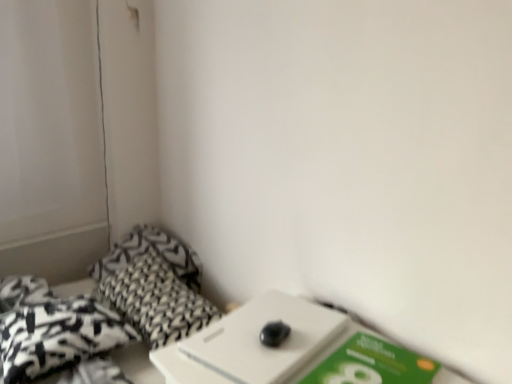
Image resolution: width=512 pixels, height=384 pixels. What do you see at coordinates (108, 309) in the screenshot?
I see `black printed fabric at lower left` at bounding box center [108, 309].

The image size is (512, 384). Describe the element at coordinates (293, 350) in the screenshot. I see `white plastic table at lower left` at that location.

This screenshot has width=512, height=384. Identify the location of black textured pillow at lower left, which is the first pillow in back-to-front order. (147, 250).

This screenshot has width=512, height=384. Describe the element at coordinates (147, 250) in the screenshot. I see `black textured pillow at lower left, which appears as the 2th pillow when viewed from the front` at that location.

Image resolution: width=512 pixels, height=384 pixels. What do you see at coordinates (58, 335) in the screenshot?
I see `black and white patterned throw pillow at lower left` at bounding box center [58, 335].

Where is `black and white patterned throw pillow at lower left`? This screenshot has width=512, height=384. black and white patterned throw pillow at lower left is located at coordinates (58, 335).

What are the coordinates of `green matte paperback book at lower right` in the screenshot? It's located at (372, 364).

Identify the location of black printed fabric at lower left. (108, 309).

Could you tell me if black printed fabric at lower left is facing green matte paperback book at lower right?

Yes, black printed fabric at lower left is aimed at green matte paperback book at lower right.

Does black printed fabric at lower left have a smaller size compared to green matte paperback book at lower right?

Incorrect, black printed fabric at lower left is not smaller in size than green matte paperback book at lower right.

From a real-world perspective, is black printed fabric at lower left beneath green matte paperback book at lower right?

Yes.

Between black printed fabric at lower left and green matte paperback book at lower right, which one has smaller width?

Thinner between the two is green matte paperback book at lower right.

Locate an element on the screen. the 1st pillow positioned below the green matte paperback book at lower right (from a real-world perspective) is located at coordinates (147, 250).

Do you think black textured pillow at lower left, which appears as the 2th pillow when viewed from the front, is within green matte paperback book at lower right, or outside of it?

black textured pillow at lower left, which appears as the 2th pillow when viewed from the front, is outside green matte paperback book at lower right.

Looking at this image, from a real-world perspective, is black textured pillow at lower left, which appears as the 2th pillow when viewed from the front, positioned above or below green matte paperback book at lower right?

From a real-world perspective, black textured pillow at lower left, which appears as the 2th pillow when viewed from the front, is physically below green matte paperback book at lower right.

Is black textured pillow at lower left, the 1th pillow from the front, in front of or behind black printed fabric at lower left in the image?

black textured pillow at lower left, the 1th pillow from the front, is behind black printed fabric at lower left.

Is black textured pillow at lower left, the 2th pillow in the back-to-front sequence, facing towards black printed fabric at lower left?

No, black textured pillow at lower left, the 2th pillow in the back-to-front sequence, is not turned towards black printed fabric at lower left.

Considering the sizes of objects black textured pillow at lower left, the 2th pillow in the back-to-front sequence, and black printed fabric at lower left in the image provided, who is shorter, black textured pillow at lower left, the 2th pillow in the back-to-front sequence, or black printed fabric at lower left?

black textured pillow at lower left, the 2th pillow in the back-to-front sequence, is shorter.

Could you tell me if white plastic table at lower left is facing black textured pillow at lower left, the 2th pillow in the back-to-front sequence?

No, white plastic table at lower left is not facing towards black textured pillow at lower left, the 2th pillow in the back-to-front sequence.

Considering the relative positions of white plastic table at lower left and black textured pillow at lower left, the 2th pillow in the back-to-front sequence, in the image provided, is white plastic table at lower left behind black textured pillow at lower left, the 2th pillow in the back-to-front sequence,?

No, it is in front of black textured pillow at lower left, the 2th pillow in the back-to-front sequence.

From the image's perspective, relative to black textured pillow at lower left, the 2th pillow in the back-to-front sequence, is white plastic table at lower left above or below?

From the image's perspective, white plastic table at lower left appears above black textured pillow at lower left, the 2th pillow in the back-to-front sequence.

Would you say white plastic table at lower left contains black textured pillow at lower left, the 2th pillow in the back-to-front sequence?

No.

Is black printed fabric at lower left smaller than black textured pillow at lower left, which is the first pillow in back-to-front order?

Incorrect, black printed fabric at lower left is not smaller in size than black textured pillow at lower left, which is the first pillow in back-to-front order.

Which of these two, black printed fabric at lower left or black textured pillow at lower left, which appears as the 2th pillow when viewed from the front, stands taller?

black printed fabric at lower left.

From the image's perspective, which one is positioned higher, black printed fabric at lower left or black textured pillow at lower left, which appears as the 2th pillow when viewed from the front?

black textured pillow at lower left, which appears as the 2th pillow when viewed from the front, is shown above in the image.

Considering their positions, is green matte paperback book at lower right located in front of or behind black and white patterned throw pillow at lower left?

In the image, green matte paperback book at lower right appears in front of black and white patterned throw pillow at lower left.

Is green matte paperback book at lower right inside or outside of black and white patterned throw pillow at lower left?

green matte paperback book at lower right is not inside black and white patterned throw pillow at lower left, it's outside.

Is point (361, 358) closer to camera compared to point (65, 352)?

Yes, it is.

What are the coordinates of `paperback book above the black and white patterned throw pillow at lower left (from a real-world perspective)` in the screenshot? It's located at (372, 364).

Would you say black and white patterned throw pillow at lower left is outside white plastic table at lower left?

Indeed, black and white patterned throw pillow at lower left is completely outside white plastic table at lower left.

Which of these two, black and white patterned throw pillow at lower left or white plastic table at lower left, stands taller?

black and white patterned throw pillow at lower left.

Is black and white patterned throw pillow at lower left oriented away from white plastic table at lower left?

No, white plastic table at lower left is not at the back of black and white patterned throw pillow at lower left.

Locate an element on the screen. The width and height of the screenshot is (512, 384). bed behind the green matte paperback book at lower right is located at coordinates (108, 309).

Locate an element on the screen. The height and width of the screenshot is (384, 512). paperback book above the black textured pillow at lower left, which appears as the 2th pillow when viewed from the front (from a real-world perspective) is located at coordinates (372, 364).

Estimate the real-world distances between objects in this image. Which object is closer to green matte paperback book at lower right, black textured pillow at lower left, which appears as the 2th pillow when viewed from the front, or black printed fabric at lower left?

black printed fabric at lower left lies closer to green matte paperback book at lower right than the other object.

Which object lies further to the anchor point black and white patterned throw pillow at lower left, black textured pillow at lower left, the 1th pillow from the front, or black printed fabric at lower left?

Among the two, black textured pillow at lower left, the 1th pillow from the front, is located further to black and white patterned throw pillow at lower left.

When comparing their distances from black textured pillow at lower left, the 1th pillow from the front, does black textured pillow at lower left, which is the first pillow in back-to-front order, or white plastic table at lower left seem further?

The object further to black textured pillow at lower left, the 1th pillow from the front, is white plastic table at lower left.

Considering their positions, is green matte paperback book at lower right positioned further to black textured pillow at lower left, which appears as the 2th pillow when viewed from the front, than black textured pillow at lower left, the 1th pillow from the front?

green matte paperback book at lower right is positioned further to the anchor black textured pillow at lower left, which appears as the 2th pillow when viewed from the front.

From the picture: Considering their positions, is black textured pillow at lower left, the 1th pillow from the front, positioned closer to black and white patterned throw pillow at lower left than white plastic table at lower left?

Among the two, black textured pillow at lower left, the 1th pillow from the front, is located nearer to black and white patterned throw pillow at lower left.

Considering their positions, is black printed fabric at lower left positioned further to black textured pillow at lower left, which is the first pillow in back-to-front order, than black and white patterned throw pillow at lower left?

black and white patterned throw pillow at lower left.

From the image, which object appears to be farther from green matte paperback book at lower right, white plastic table at lower left or black and white patterned throw pillow at lower left?

Based on the image, black and white patterned throw pillow at lower left appears to be further to green matte paperback book at lower right.

When comparing their distances from white plastic table at lower left, does black textured pillow at lower left, which appears as the 2th pillow when viewed from the front, or green matte paperback book at lower right seem further?

black textured pillow at lower left, which appears as the 2th pillow when viewed from the front.

This screenshot has height=384, width=512. I want to click on throw pillow between black printed fabric at lower left and black textured pillow at lower left, the 2th pillow in the back-to-front sequence, along the z-axis, so click(x=58, y=335).

Where is `bed between black and white patterned throw pillow at lower left and green matte paperback book at lower right`? The image size is (512, 384). bed between black and white patterned throw pillow at lower left and green matte paperback book at lower right is located at coordinates (108, 309).

What are the coordinates of `throw pillow between white plastic table at lower left and black textured pillow at lower left, which is the first pillow in back-to-front order, from front to back` in the screenshot? It's located at (58, 335).

Locate an element on the screen. bed between white plastic table at lower left and black textured pillow at lower left, which appears as the 2th pillow when viewed from the front, in the front-back direction is located at coordinates (108, 309).